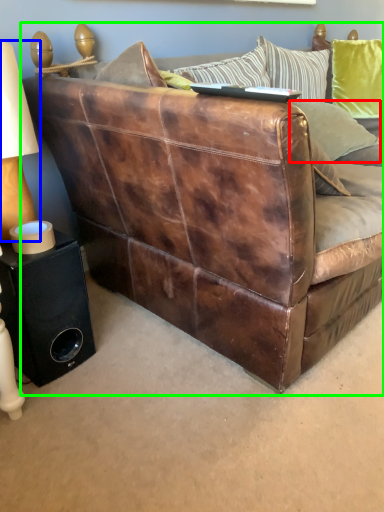
Question: Based on their relative distances, which object is farther from pillow (highlighted by a red box)? Choose from table lamp (highlighted by a blue box) and studio couch (highlighted by a green box).

Choices:
 (A) table lamp
 (B) studio couch

Answer: (A)